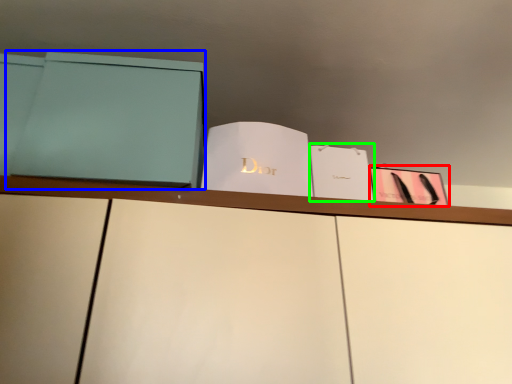
Question: Based on their relative distances, which object is farther from paperback book (highlighted by a red box)? Choose from paperback book (highlighted by a blue box) and paperback book (highlighted by a green box).

Choices:
 (A) paperback book
 (B) paperback book

Answer: (A)